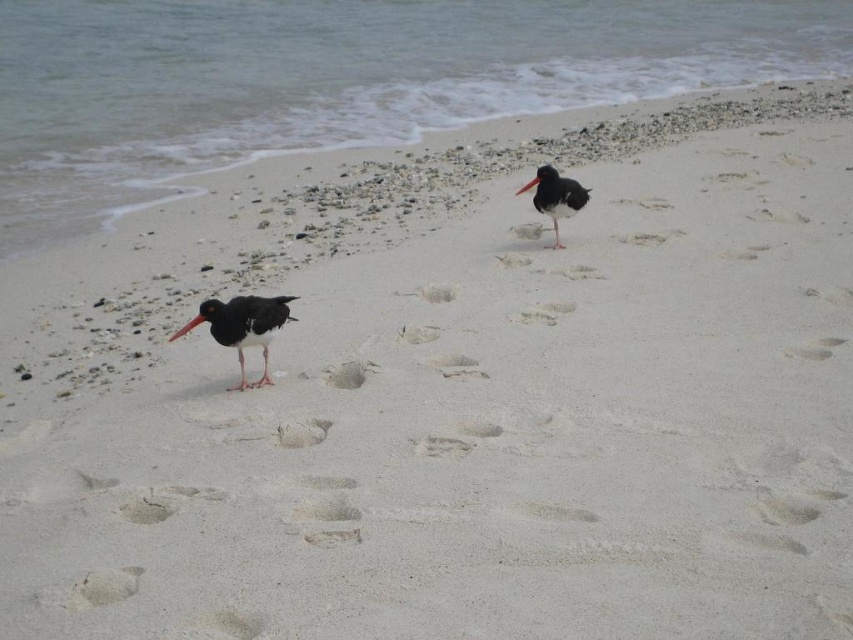
You are a birdwatcher observing the beach scene. You notice the black glossy oystercatcher at center and the black matte beak at upper right. Which object is located more to the left side of the scene?

The black glossy oystercatcher at center is positioned on the left side of the black matte beak at upper right, so it is more to the left.

You are a photographer standing on the beach and want to capture both the black glossy oystercatcher at center and the black matte beak at upper right in the same frame. Given that your camera has a 50mm lens which has a field of view that can capture objects up to 6 feet apart, will you be able to include both in your photo?

The black glossy oystercatcher at center is 7.58 feet from the black matte beak at upper right. Since the distance between them exceeds the 6 feet field of view of the 50mm lens, you won

You are a photographer trying to capture the black glossy bird at center in your shot. The camera is set up at the beach shore. Based on the coordinates provided, can you determine if the bird is positioned closer to the water or the sand dunes?

The black glossy bird at center is located at coordinates point (555,196). Since the y coordinate is 0.652, which is closer to 0.5 than 1, it means the bird is positioned closer to the water than the sand dunes.